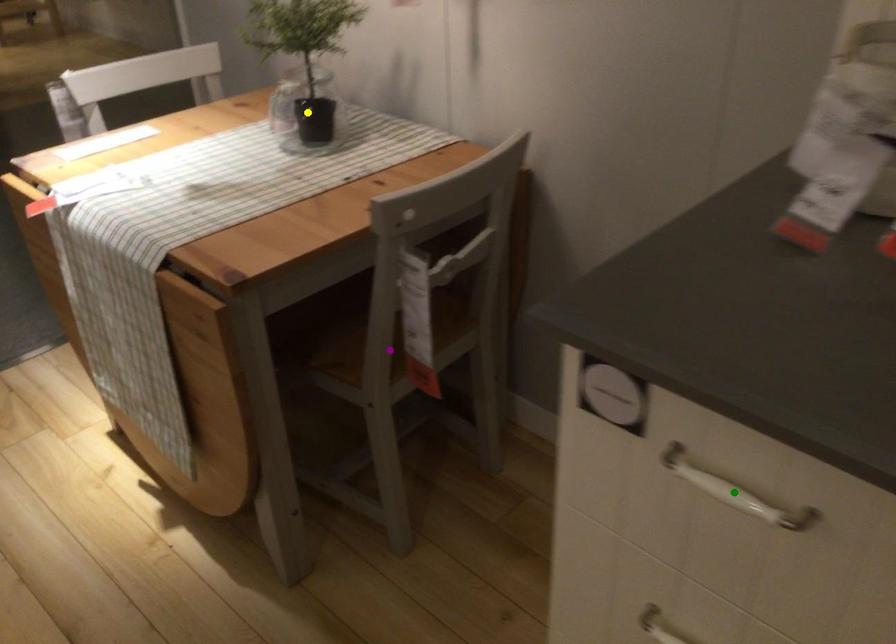
Order these from nearest to farthest:
- yellow point
- green point
- purple point

green point → purple point → yellow point